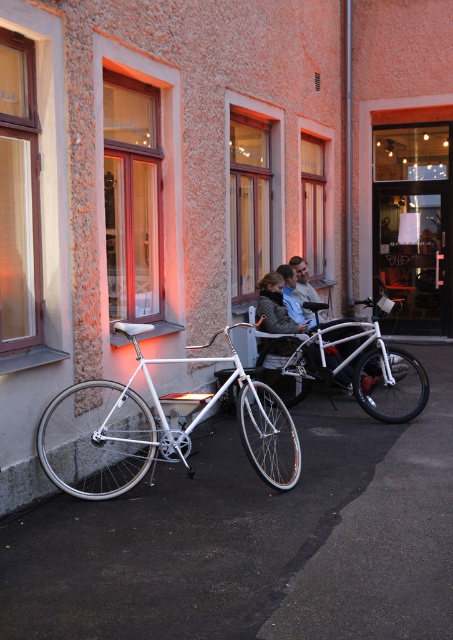
You are a delivery person who needs to park your white metallic bicycle at left near the transparent glass door at center. Considering their heights, can the bicycle fit through the doorway without tilting it?

The white metallic bicycle at left has a lesser height compared to transparent glass door at center, so the bicycle can fit through the doorway without tilting it since its height is lower than the door.

You are a delivery person who needs to move a package from the white metallic bicycle at left to the white matte bicycle at center. Which direction should you move the package?

The white metallic bicycle at left is to the left of the white matte bicycle at center, so you should move the package to the right to reach the white matte bicycle at center.

You are a delivery person with a package that needs to be placed next to the white metallic bicycle at left without blocking the transparent glass door at center. Given their sizes, can you safely place the package there?

The white metallic bicycle at left is larger than the transparent glass door at center. Since the bicycle is bigger, there should be enough space to place the package next to it without blocking the door.